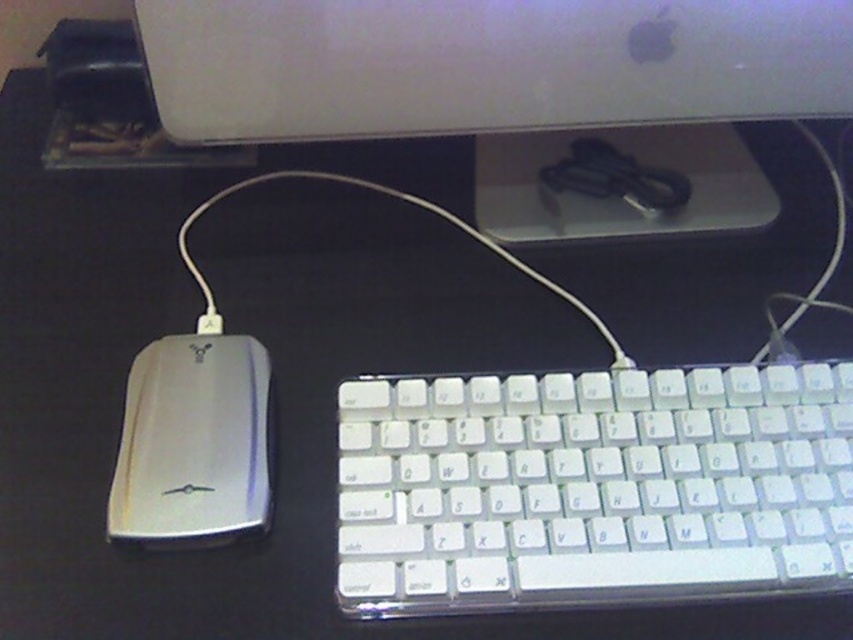
You are organizing cables in a workspace. You see the satin white monitor at upper center and the white cable at lower left. Which object is closer to you?

The satin white monitor at upper center is closer to you since it is in front of the white cable at lower left.

You are organizing cables in a workspace. You see the satin white monitor at upper center and the white cable at lower left. Which object is positioned higher in the image?

The satin white monitor at upper center is positioned higher than the white cable at lower left.